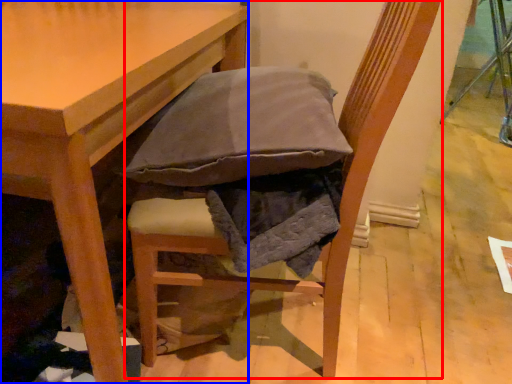
Question: Which of the following is the closest to the observer, chair (highlighted by a red box) or table (highlighted by a blue box)?

Choices:
 (A) chair
 (B) table

Answer: (B)